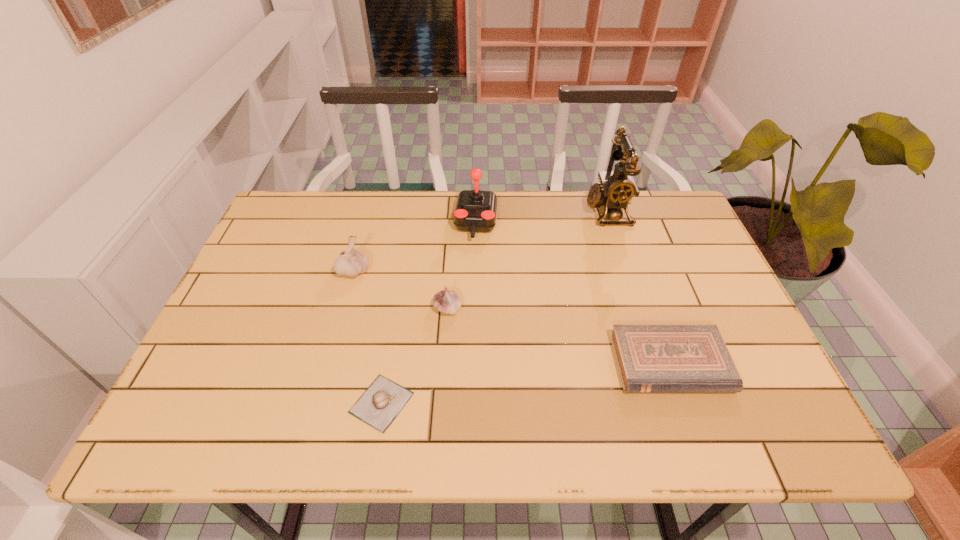
The image size is (960, 540). Identify the location of the tallest object. (616, 189).

You are a GUI agent. You are given a task and a screenshot of the screen. Output one action in this format:
    pyautogui.click(x=<x>, y=<y>)
    Task: Click on the fifth shortest object
    The height and width of the screenshot is (540, 960).
    Given the screenshot: What is the action you would take?
    pyautogui.click(x=476, y=211)

Identify the location of the farthest garlic. Image resolution: width=960 pixels, height=540 pixels. (351, 262).

You are a GUI agent. You are given a task and a screenshot of the screen. Output one action in this format:
    pyautogui.click(x=<x>, y=<y>)
    Task: Click on the fourth shortest object
    The image size is (960, 540).
    Given the screenshot: What is the action you would take?
    click(x=351, y=262)

The image size is (960, 540). What are the coordinates of `the second nearest garlic` in the screenshot? It's located at (448, 302).

This screenshot has width=960, height=540. In order to click on the fourth tallest object in this screenshot , I will do `click(448, 302)`.

You are a GUI agent. You are given a task and a screenshot of the screen. Output one action in this format:
    pyautogui.click(x=<x>, y=<y>)
    Task: Click on the Bible
    
    Given the screenshot: What is the action you would take?
    pyautogui.click(x=650, y=358)

Locate an element on the screen. The width and height of the screenshot is (960, 540). the shortest object is located at coordinates (383, 400).

Where is `the nearest garlic`? The height and width of the screenshot is (540, 960). the nearest garlic is located at coordinates (383, 400).

Find the location of `blank space located on the rotary dial of the tallest object`. blank space located on the rotary dial of the tallest object is located at coordinates (498, 211).